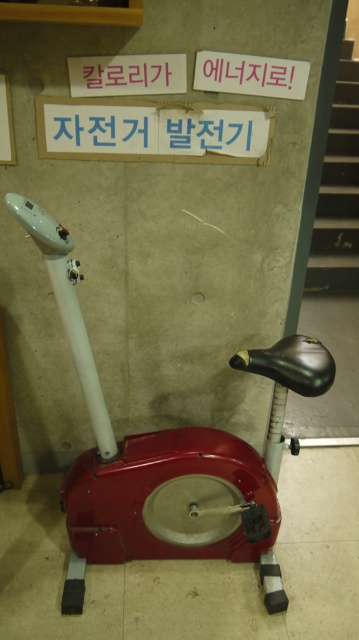
Is smooth concrete stairs at right smaller than white paper at upper center?

Actually, smooth concrete stairs at right might be larger than white paper at upper center.

Does point (327, 237) lie behind point (282, 81)?

Yes, point (327, 237) is behind point (282, 81).

Between point (332, 266) and point (277, 84), which one is positioned behind?

Point (332, 266)

The width and height of the screenshot is (359, 640). I want to click on smooth concrete stairs at right, so click(338, 192).

Consider the image. Does blue paper sign at center have a smaller size compared to red plastic sign at upper center?

Actually, blue paper sign at center might be larger than red plastic sign at upper center.

Which is in front, point (118, 148) or point (143, 58)?

Point (143, 58) is in front.

Find the location of a particular element. This screenshot has height=640, width=359. blue paper sign at center is located at coordinates (154, 131).

Is matte pink sign at upper center bigger than white paper at upper center?

Incorrect, matte pink sign at upper center is not larger than white paper at upper center.

Is matte pink sign at upper center closer to the viewer compared to white paper at upper center?

Yes.

Between point (73, 81) and point (305, 74), which one is positioned behind?

The point (305, 74) is behind.

Locate an element on the screen. The height and width of the screenshot is (640, 359). matte pink sign at upper center is located at coordinates (127, 74).